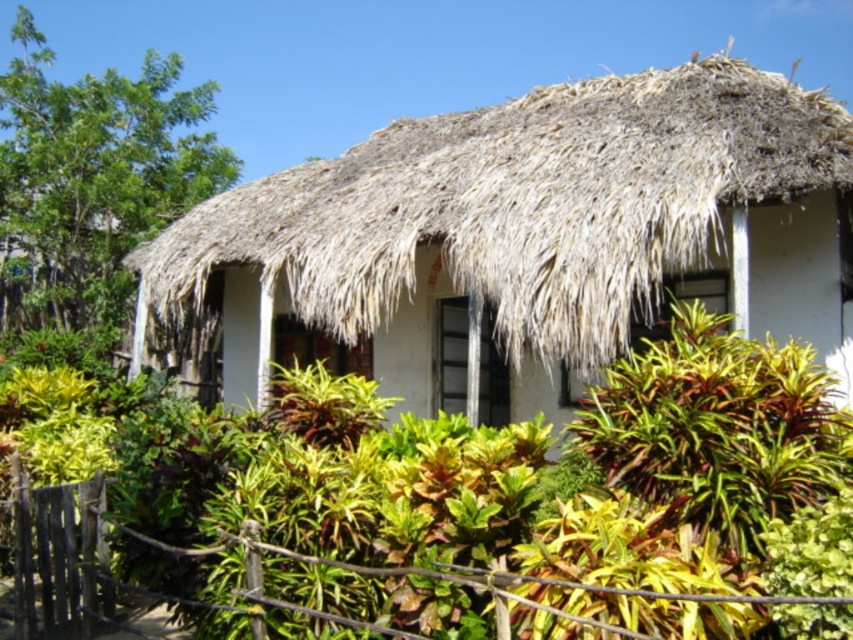
You are a landscape architect planning to add a new pathway in the garden. The pathway must be wide enough to accommodate a 2.5 meter wide sculpture. Given the green leafy tree at upper left and the wooden fence at lower center, which object can the pathway be placed next to without obstructing the view of the other object?

The pathway can be placed next to the wooden fence at lower center since the green leafy tree at upper left is wider than the wooden fence at lower center, ensuring there is enough space to place the pathway without obstructing the view of the tree.

You are a visitor standing in front of the white thatch hut at center and the wooden fence at lower center. Which object would you need to walk around to get to the other side?

The white thatch hut at center is bigger than the wooden fence at lower center, so you would need to walk around the white thatch hut at center to get to the other side.